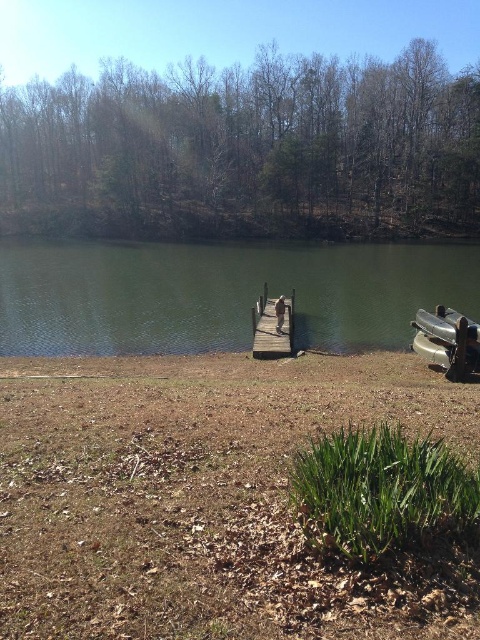
Question: Considering the real-world distances, which object is farthest from the wooden dock at center?

Choices:
 (A) brown dry grass at lower left
 (B) green smooth water at center
 (C) metallic gray boat at lower right

Answer: (B)

Question: Among these points, which one is farthest from the camera?

Choices:
 (A) (256, 353)
 (B) (58, 243)

Answer: (B)

Question: Which object appears closest to the camera in this image?

Choices:
 (A) brown dry grass at lower left
 (B) metallic gray boat at lower right
 (C) wooden dock at center
 (D) green smooth water at center

Answer: (A)

Question: Observing the image, what is the correct spatial positioning of brown dry grass at lower left in reference to wooden dock at center?

Choices:
 (A) right
 (B) left

Answer: (A)

Question: Is brown dry grass at lower left closer to camera compared to metallic gray boat at lower right?

Choices:
 (A) yes
 (B) no

Answer: (A)

Question: Observing the image, what is the correct spatial positioning of brown dry grass at lower left in reference to green smooth water at center?

Choices:
 (A) right
 (B) left

Answer: (A)